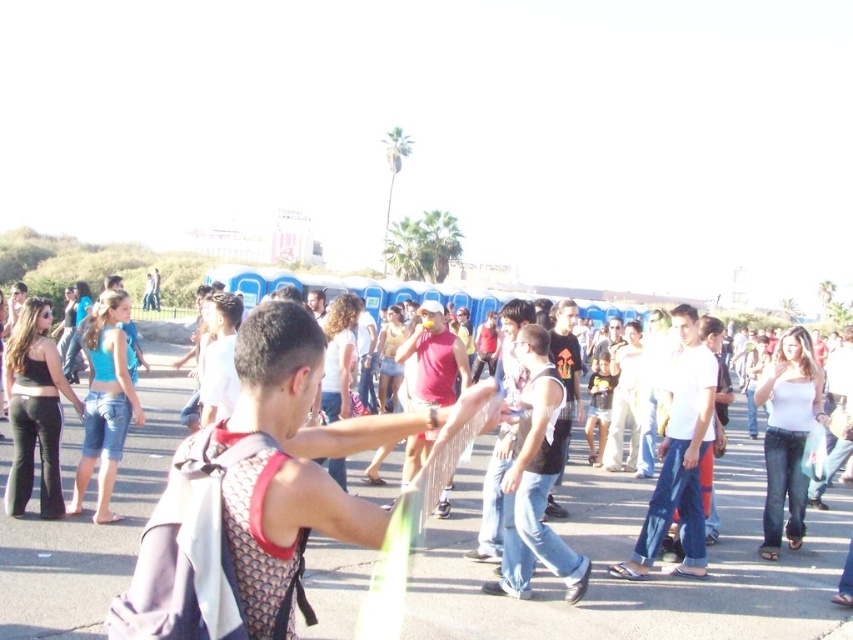
Question: Among these points, which one is nearest to the camera?

Choices:
 (A) (549, 516)
 (B) (554, 465)

Answer: (B)

Question: Considering the real-world distances, which object is closest to the mesh fabric tank top at center?

Choices:
 (A) dark gray t-shirt at center
 (B) matte red tank top at center

Answer: (A)

Question: Does matte red tank top at center have a larger size compared to dark gray t-shirt at center?

Choices:
 (A) yes
 (B) no

Answer: (B)

Question: Is the position of dark gray tank top at center more distant than that of dark gray t-shirt at center?

Choices:
 (A) no
 (B) yes

Answer: (A)

Question: Which point appears farthest from the camera in this image?

Choices:
 (A) (294, 545)
 (B) (547, 474)
 (C) (646, 548)

Answer: (C)

Question: Can you confirm if mesh fabric tank top at center is positioned to the right of matte red tank top at center?

Choices:
 (A) no
 (B) yes

Answer: (A)